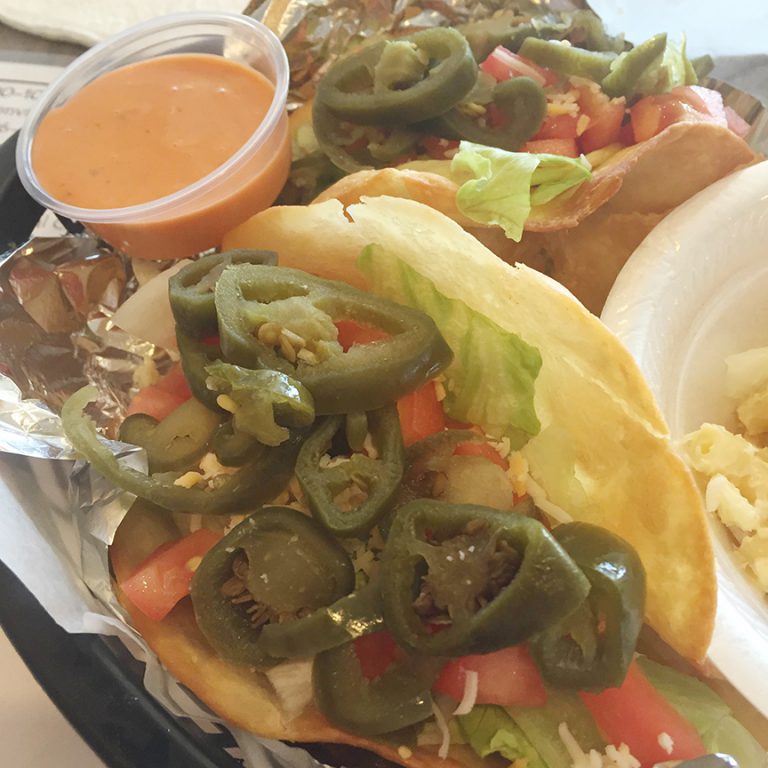
At what (x,y) coordinates should I click in order to perform the action: click on plastic sauce container. Please return your answer as a coordinate pair (x, y). This screenshot has height=768, width=768. Looking at the image, I should click on (237, 161).